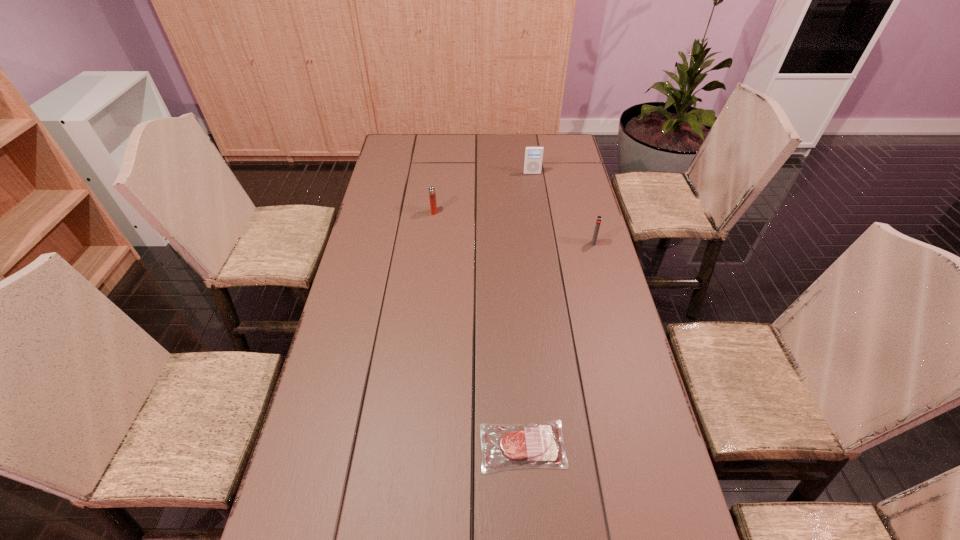
Where is `free area in between the third nearest object and the steak`? The image size is (960, 540). free area in between the third nearest object and the steak is located at coordinates (478, 329).

At what (x,y) coordinates should I click in order to perform the action: click on free space between the farthest object and the nearer igniter. Please return your answer as a coordinate pair (x, y). Looking at the image, I should click on (563, 208).

This screenshot has width=960, height=540. I want to click on vacant area that lies between the shortest object and the second farthest object, so click(478, 329).

Locate an element on the screen. The height and width of the screenshot is (540, 960). vacant point located between the farther igniter and the rightmost object is located at coordinates (514, 227).

You are a GUI agent. You are given a task and a screenshot of the screen. Output one action in this format:
    pyautogui.click(x=<x>, y=<y>)
    Task: Click on the vacant area that lies between the steak and the farthest object
    The height and width of the screenshot is (540, 960).
    Given the screenshot: What is the action you would take?
    pyautogui.click(x=527, y=310)

Locate an element on the screen. The image size is (960, 540). vacant point located between the nearest object and the left igniter is located at coordinates (478, 329).

Identify which object is the third closest to the nearest object. Please provide its 2D coordinates. Your answer should be formatted as a tuple, i.e. [(x, y)], where the tuple contains the x and y coordinates of a point satisfying the conditions above.

[(533, 159)]

This screenshot has height=540, width=960. What are the coordinates of `object that is the closest to the iPod` in the screenshot? It's located at (432, 195).

Identify the location of free space that satisfies the following two spatial constraints: 1. on the front-facing side of the iPod; 2. on the left side of the nearer igniter. The image size is (960, 540). (542, 243).

The image size is (960, 540). What are the coordinates of `free space that satisfies the following two spatial constraints: 1. on the front-facing side of the nearer igniter; 2. on the right side of the iPod` in the screenshot? It's located at (542, 243).